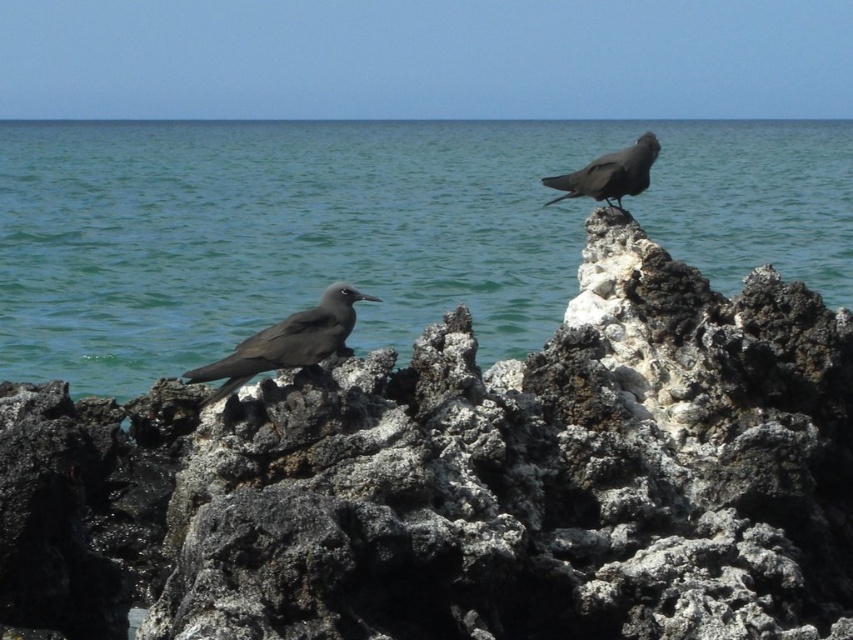
Measure the distance between blue water at center and matte black bird at upper right.

blue water at center and matte black bird at upper right are 25.23 meters apart from each other.

Looking at this image, can you confirm if blue water at center is wider than matte black bird at upper right?

Yes.

Does point (206, 314) come closer to viewer compared to point (610, 188)?

No, (206, 314) is further to viewer.

Find the location of a particular element. The width and height of the screenshot is (853, 640). blue water at center is located at coordinates (369, 228).

Between point (583, 330) and point (531, 241), which one is positioned in front?

Point (583, 330)

Measure the distance from rough textured rock at center to blue water at center.

rough textured rock at center and blue water at center are 38.34 feet apart from each other.

Identify the location of rough textured rock at center. This screenshot has width=853, height=640. (463, 481).

Between rough textured rock at center and matte black bird at lower left, which one appears on the right side from the viewer's perspective?

rough textured rock at center is more to the right.

Does point (767, 374) come closer to viewer compared to point (347, 305)?

No, (767, 374) is further to viewer.

I want to click on rough textured rock at center, so (463, 481).